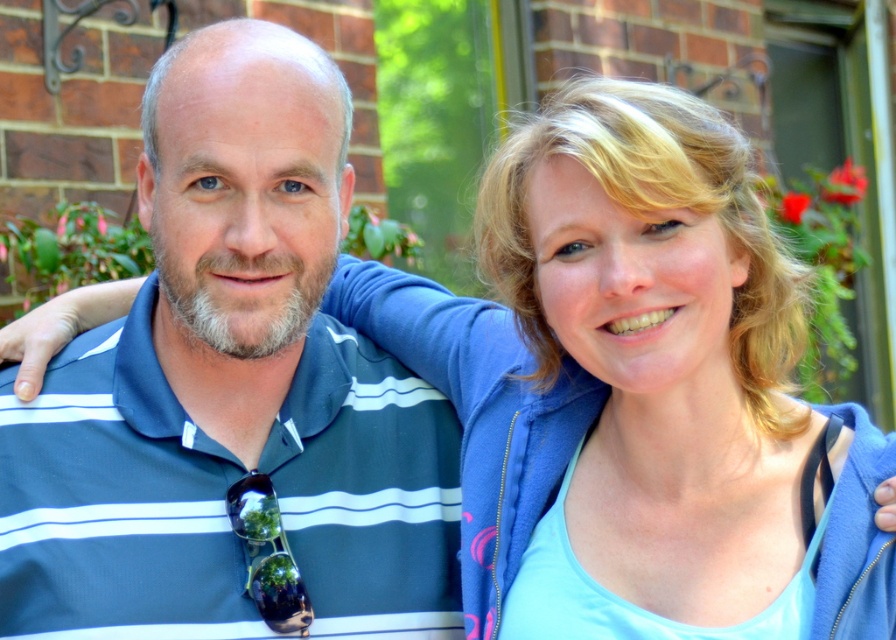
Question: Is blue striped polo shirt at left closer to the viewer compared to blonde hair at upper right?

Choices:
 (A) no
 (B) yes

Answer: (A)

Question: Among these points, which one is farthest from the camera?

Choices:
 (A) (610, 92)
 (B) (162, 115)

Answer: (B)

Question: Which of the following is the closest to the observer?

Choices:
 (A) (659, 339)
 (B) (366, 508)

Answer: (A)

Question: Does blue striped polo shirt at left have a larger size compared to blonde hair at upper right?

Choices:
 (A) no
 (B) yes

Answer: (B)

Question: Is blue striped polo shirt at left above blonde hair at upper right?

Choices:
 (A) yes
 (B) no

Answer: (A)